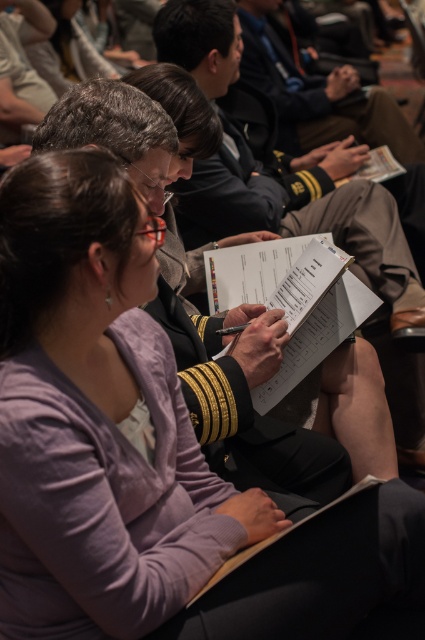
Does white paper clipboard at center appear on the left side of navy blue uniform at upper center?

Yes, white paper clipboard at center is to the left of navy blue uniform at upper center.

Is white paper clipboard at center behind navy blue uniform at upper center?

No, it is in front of navy blue uniform at upper center.

Is point (353, 291) closer to camera compared to point (402, 131)?

Yes, it is.

At what (x,y) coordinates should I click in order to perform the action: click on white paper clipboard at center. Please return your answer as a coordinate pair (x, y). Looking at the image, I should click on (289, 300).

Does point (354, 227) lie in front of point (289, 120)?

That is True.

Can you confirm if uniformed officer at center is positioned to the left of navy blue uniform at upper center?

Yes, uniformed officer at center is to the left of navy blue uniform at upper center.

Does point (323, 211) come closer to viewer compared to point (263, 32)?

Yes, point (323, 211) is in front of point (263, 32).

Find the location of `uniformed officer at center`. uniformed officer at center is located at coordinates (258, 188).

From the picture: Which is more to the right, uniformed officer at center or white paper clipboard at center?

uniformed officer at center is more to the right.

Does uniformed officer at center appear over white paper clipboard at center?

Indeed, uniformed officer at center is positioned over white paper clipboard at center.

In order to click on uniformed officer at center in this screenshot , I will do `click(258, 188)`.